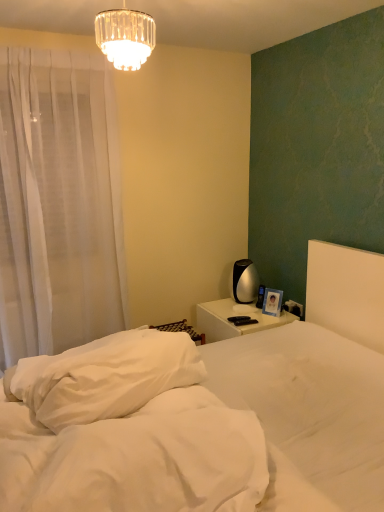
Question: Relative to white soft mattress at lower center, is black plastic electric outlet at right in front or behind?

Choices:
 (A) front
 (B) behind

Answer: (B)

Question: Is point (288, 305) closer or farther from the camera than point (134, 506)?

Choices:
 (A) closer
 (B) farther

Answer: (B)

Question: Estimate the real-world distances between objects in this image. Which object is closer to the crystal glass chandelier at upper center?

Choices:
 (A) black plastic electric outlet at right
 (B) white soft bed at center
 (C) white glossy nightstand at center
 (D) matte blue photo frame at right
 (E) white soft pillow at left

Answer: (E)

Question: Which is nearer to the black plastic electric outlet at right?

Choices:
 (A) white soft mattress at lower center
 (B) white sheer curtain at left
 (C) matte blue photo frame at right
 (D) white soft bed at center
 (E) white soft pillow at left

Answer: (C)